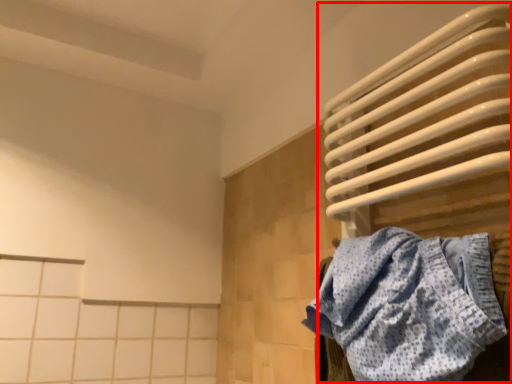
Question: From the image, what is the correct spatial relationship of water heater (annotated by the red box) in relation to towel?

Choices:
 (A) right
 (B) left

Answer: (A)